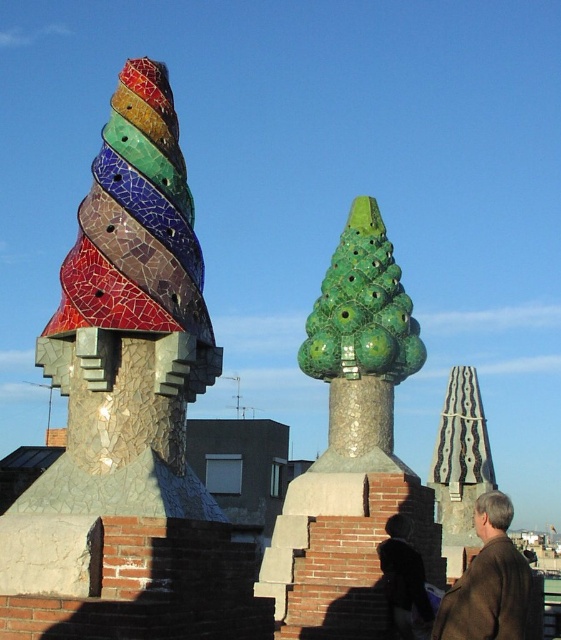
You are standing in front of the architectural detail of Casa Batll? in Barcelona and notice the cracked mosaic chimney at left and the brown woolen jacket at lower right. Which object is located more to the left?

The cracked mosaic chimney at left is positioned on the left side of the brown woolen jacket at lower right, so it is more to the left.

You are an architect analyzing the structural integrity of the chimneys in the image. Given that the cracked mosaic chimney at left is positioned at coordinates 0.506, 0.234, would its location affect its stability compared to the other chimney?

The cracked mosaic chimney at left is located at point (131, 323), which might indicate its placement could affect structural stability due to potential uneven weight distribution or exposure to environmental factors, but without additional data on the building structure, this is speculative.